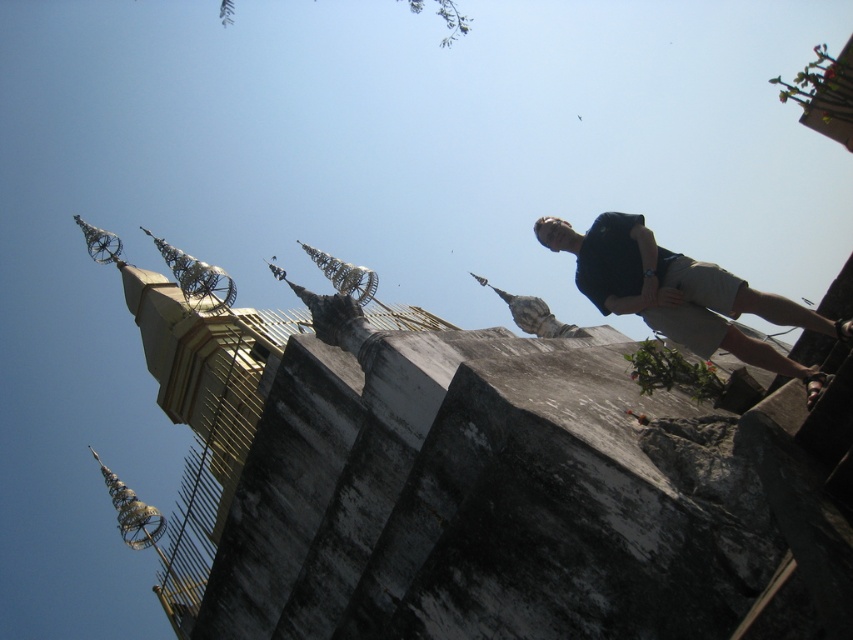
Between point (166, 253) and point (625, 230), which one is positioned in front?

Positioned in front is point (625, 230).

Does point (204, 448) lie in front of point (747, 355)?

That is False.

Describe the element at coordinates (195, 403) in the screenshot. I see `gold metallic spire at upper left` at that location.

This screenshot has height=640, width=853. I want to click on gold metallic spire at upper left, so click(x=195, y=403).